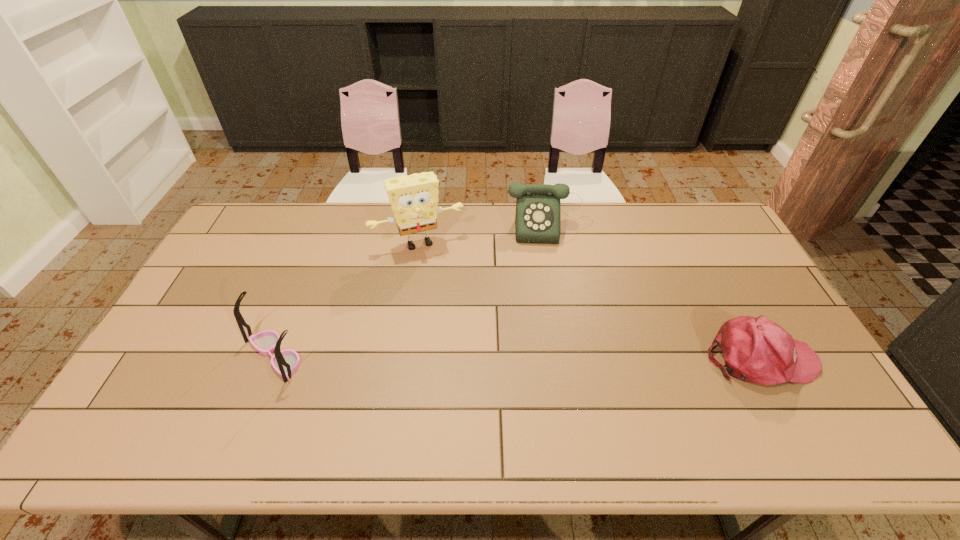
Where is `vacant space situated 0.110m on the face of the tallest object`? This screenshot has height=540, width=960. vacant space situated 0.110m on the face of the tallest object is located at coordinates (441, 276).

The image size is (960, 540). I want to click on vacant space located 0.300m on the face of the tallest object, so click(459, 319).

The image size is (960, 540). Find the location of `vacant space located on the face of the tallest object`. vacant space located on the face of the tallest object is located at coordinates (440, 272).

The width and height of the screenshot is (960, 540). I want to click on telephone that is at the far edge, so click(x=538, y=207).

This screenshot has height=540, width=960. I want to click on sponge located at the far edge, so click(414, 199).

The image size is (960, 540). What are the coordinates of `spectacles positioned at the near edge` in the screenshot? It's located at (286, 362).

This screenshot has width=960, height=540. Identify the location of baseball cap situated at the near edge. (757, 350).

The image size is (960, 540). Identify the location of object that is at the right edge. (757, 350).

At what (x,y) coordinates should I click in order to perform the action: click on object that is at the near right corner. Please return your answer as a coordinate pair (x, y). Looking at the image, I should click on (757, 350).

This screenshot has width=960, height=540. In the image, there is a desktop. What are the coordinates of `free space at the far edge` in the screenshot? It's located at (505, 217).